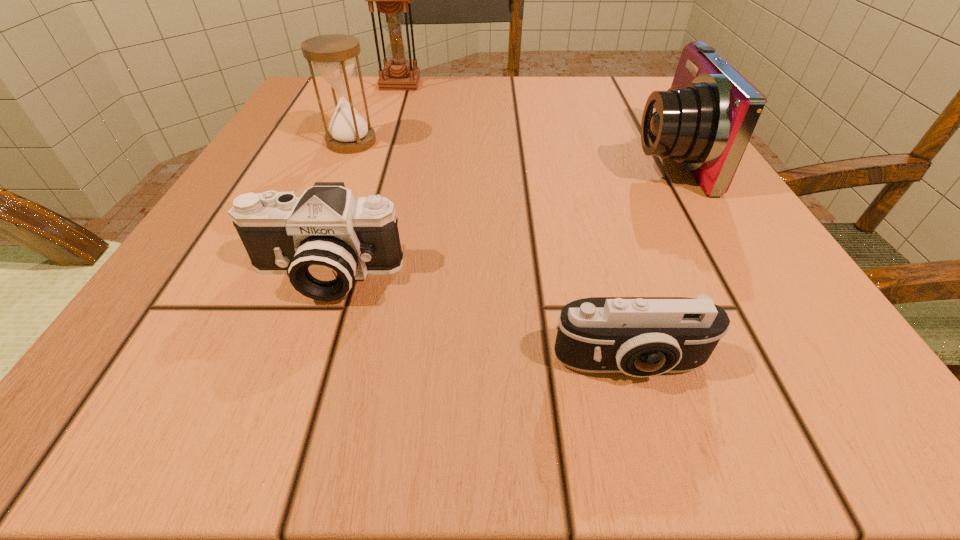
Identify the location of the farthest object. (391, 0).

Locate an element on the screen. This screenshot has width=960, height=540. the nearer hourglass is located at coordinates (333, 55).

I want to click on the rightmost camera, so click(x=705, y=120).

Locate an element on the screen. The width and height of the screenshot is (960, 540). the rightmost object is located at coordinates (705, 120).

You are a GUI agent. You are given a task and a screenshot of the screen. Output one action in this format:
    pyautogui.click(x=<x>, y=<y>)
    Task: Click on the second farthest camera
    
    Given the screenshot: What is the action you would take?
    pyautogui.click(x=324, y=240)

Locate an element on the screen. The width and height of the screenshot is (960, 540). the fourth farthest object is located at coordinates (324, 240).

Locate an element on the screen. The width and height of the screenshot is (960, 540). the nearest object is located at coordinates (641, 337).

Image resolution: width=960 pixels, height=540 pixels. Identify the location of the shortest camera. (641, 337).

Locate an element on the screen. The width and height of the screenshot is (960, 540). free space located 0.050m on the right of the farthest object is located at coordinates (442, 83).

Where is `vacant space located on the front of the nearer hourglass`? vacant space located on the front of the nearer hourglass is located at coordinates (330, 192).